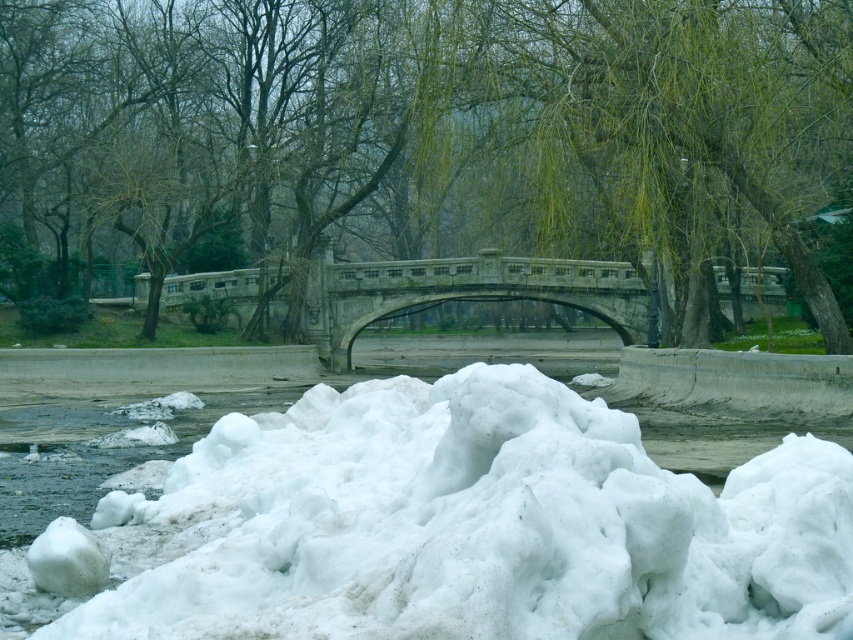
Question: Which point is closer to the camera?

Choices:
 (A) white fluffy snow at center
 (B) stone bridge at center
 (C) green leafy tree at center

Answer: (A)

Question: From the image, what is the correct spatial relationship of white fluffy snow at center in relation to stone bridge at center?

Choices:
 (A) right
 (B) left

Answer: (A)

Question: Is green leafy tree at center to the right of white fluffy snow at center from the viewer's perspective?

Choices:
 (A) yes
 (B) no

Answer: (A)

Question: Which point is farther to the camera?

Choices:
 (A) (675, 561)
 (B) (619, 250)
 (C) (334, 369)

Answer: (C)

Question: Which object is positioned farthest from the stone bridge at center?

Choices:
 (A) white fluffy snow at center
 (B) green leafy tree at center

Answer: (A)

Question: Can you confirm if green leafy tree at center is positioned above stone bridge at center?

Choices:
 (A) no
 (B) yes

Answer: (B)